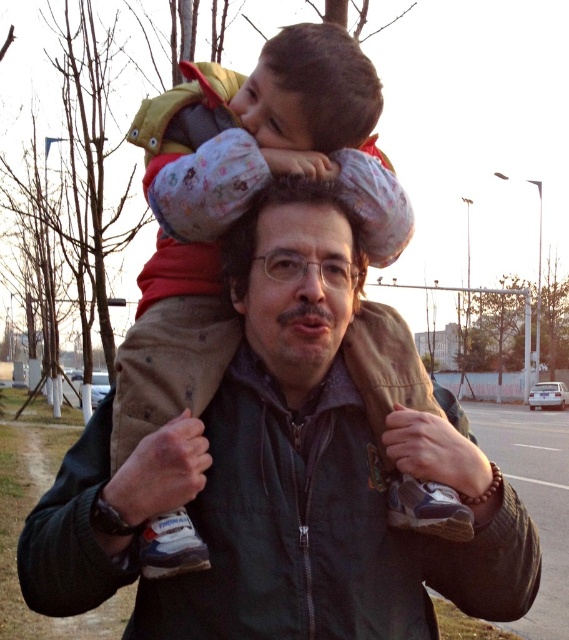
Question: Does fluffy fleece jacket at upper center appear under matte brown jacket at center?

Choices:
 (A) yes
 (B) no

Answer: (A)

Question: Does fluffy fleece jacket at upper center lie in front of matte brown jacket at center?

Choices:
 (A) yes
 (B) no

Answer: (A)

Question: From the image, what is the correct spatial relationship of fluffy fleece jacket at upper center in relation to matte brown jacket at center?

Choices:
 (A) below
 (B) above

Answer: (A)

Question: Considering the real-world distances, which object is closest to the fluffy fleece jacket at upper center?

Choices:
 (A) matte brown jacket at center
 (B) dark green jacket at center

Answer: (A)

Question: Which of the following is the closest to the observer?

Choices:
 (A) fluffy fleece jacket at upper center
 (B) dark green jacket at center

Answer: (B)

Question: Estimate the real-world distances between objects in this image. Which object is farther from the matte brown jacket at center?

Choices:
 (A) fluffy fleece jacket at upper center
 (B) dark green jacket at center

Answer: (B)